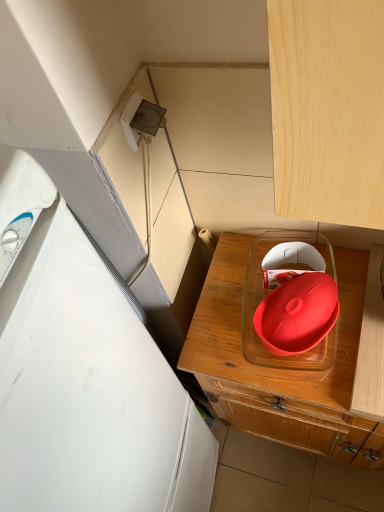
In order to click on vacant area that lies to the right of rubberized red lid at center in this screenshot , I will do `click(344, 288)`.